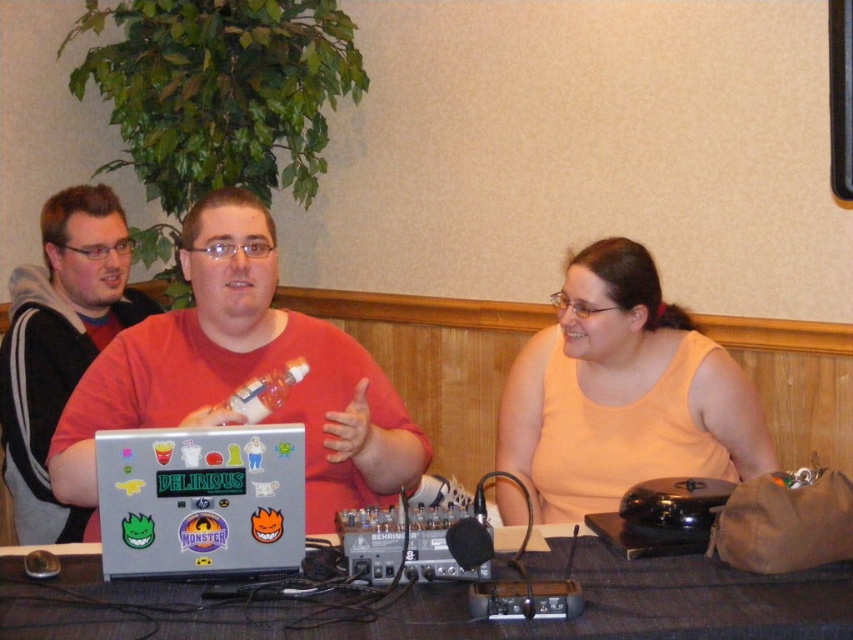
You are standing at the origin point of the coordinate system in the image. You want to walk towards the gray fabric table at center. Which direction should you move in terms of x and y coordinates?

The gray fabric table at center is located at coordinates point (448, 605), so you should move in the positive x and positive y direction to reach it.

What are the coordinates of the shiny metallic laptop at center?

The shiny metallic laptop at center is located at coordinates point (x=242, y=372).